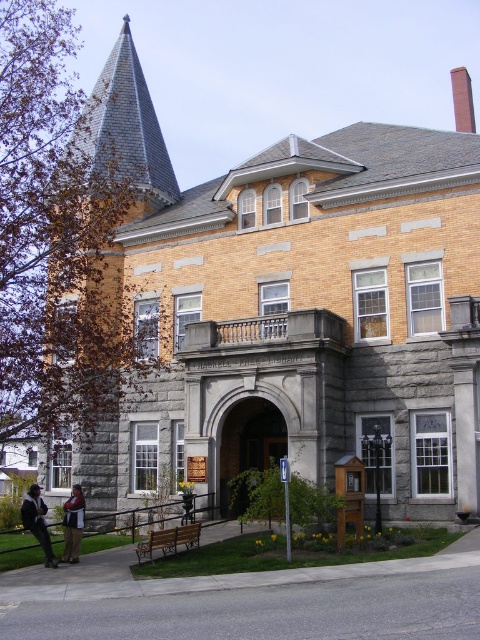
Question: Considering the real-world distances, which object is closest to the gray slate spire at upper left?

Choices:
 (A) dark brown leather jacket at lower left
 (B) denim jacket at lower left

Answer: (B)

Question: Is the position of orange brick spire at upper left less distant than that of dark brown leather jacket at lower left?

Choices:
 (A) no
 (B) yes

Answer: (A)

Question: Estimate the real-world distances between objects in this image. Which object is closer to the gray slate spire at upper left?

Choices:
 (A) dark brown leather jacket at lower left
 (B) orange brick spire at upper left
 (C) denim jacket at lower left

Answer: (B)

Question: Can you confirm if orange brick spire at upper left is wider than gray slate spire at upper left?

Choices:
 (A) no
 (B) yes

Answer: (A)

Question: Which of the following is the closest to the observer?

Choices:
 (A) (72, 509)
 (B) (32, 484)
 (C) (91, 413)

Answer: (A)

Question: Does orange brick spire at upper left have a smaller size compared to gray slate spire at upper left?

Choices:
 (A) yes
 (B) no

Answer: (A)